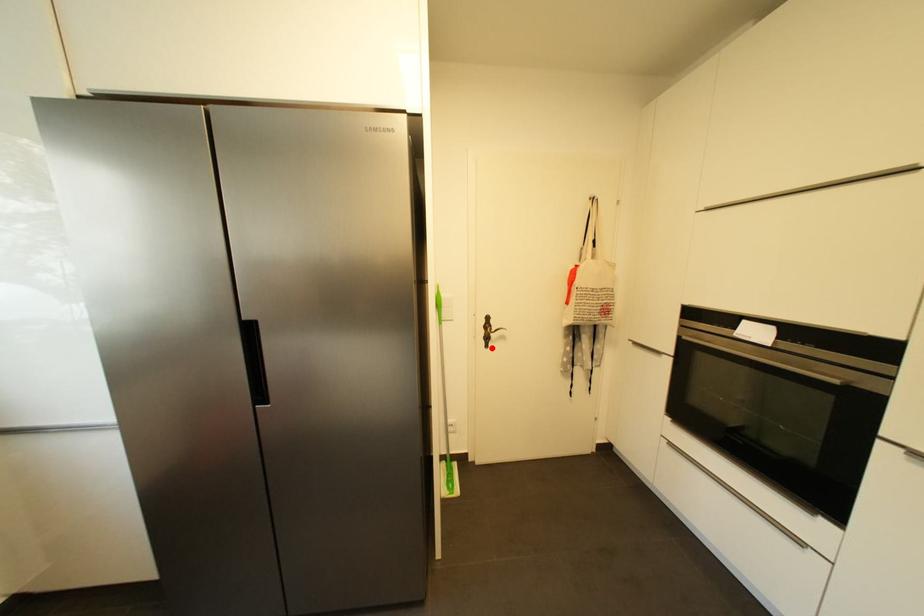
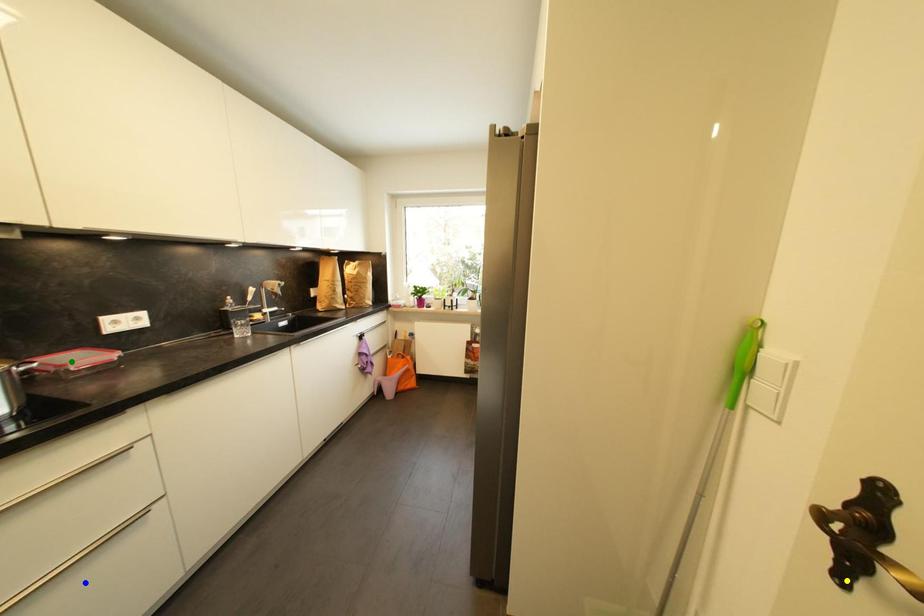
Question: I am providing you with two images of the same scene from different viewpoints. A red point is marked on the first image. You are given multiple points on the second image. Which spot in image 2 lines up with the point in image 1?

Choices:
 (A) yellow point
 (B) blue point
 (C) green point

Answer: (A)